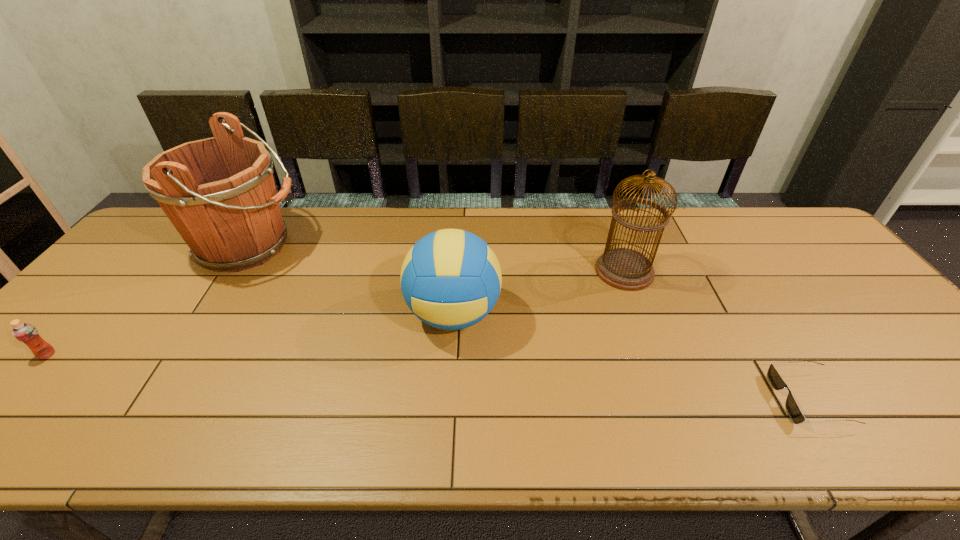
Identify the location of free spot between the nearest object and the fourth tallest object. This screenshot has width=960, height=540. (428, 376).

I want to click on vacant area that lies between the third object from right to left and the orange juice, so click(251, 334).

The width and height of the screenshot is (960, 540). What are the coordinates of `vacant region between the orange juice and the birdcage` in the screenshot? It's located at point(336,313).

At what (x,y) coordinates should I click in order to perform the action: click on free spot between the second object from left to right and the volleyball. Please return your answer as a coordinate pair (x, y). Looking at the image, I should click on (351, 280).

Where is `object that is the fourth closest to the birdcage`? object that is the fourth closest to the birdcage is located at coordinates (28, 334).

Select which object appears as the fourth closest to the fourth object from right to left. Please provide its 2D coordinates. Your answer should be formatted as a tuple, i.e. [(x, y)], where the tuple contains the x and y coordinates of a point satisfying the conditions above.

[(792, 408)]

Find the location of a particular element. vacant space that satisfies the following two spatial constraints: 1. on the front-facing side of the birdcage; 2. on the front side of the orange juice is located at coordinates 655,354.